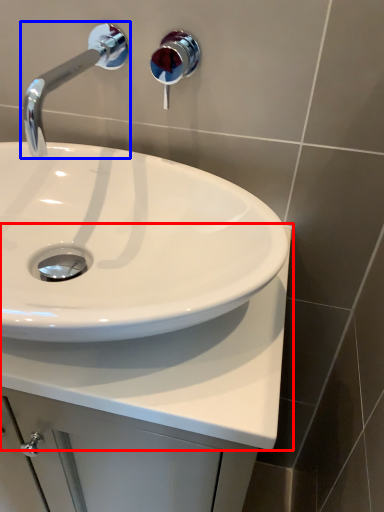
Question: Which of the following is the farthest to the observer, counter top (highlighted by a red box) or tap (highlighted by a blue box)?

Choices:
 (A) counter top
 (B) tap

Answer: (B)